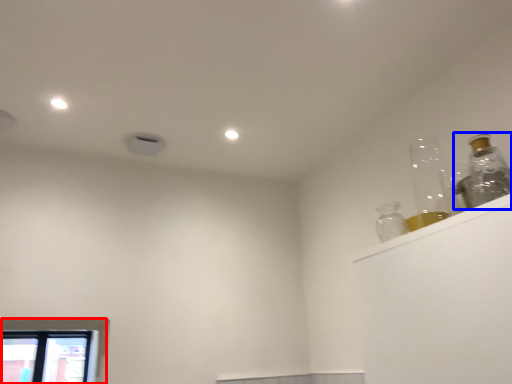
Question: Which of the following is the closest to the observer, window (highlighted by a red box) or bottle (highlighted by a blue box)?

Choices:
 (A) window
 (B) bottle

Answer: (B)